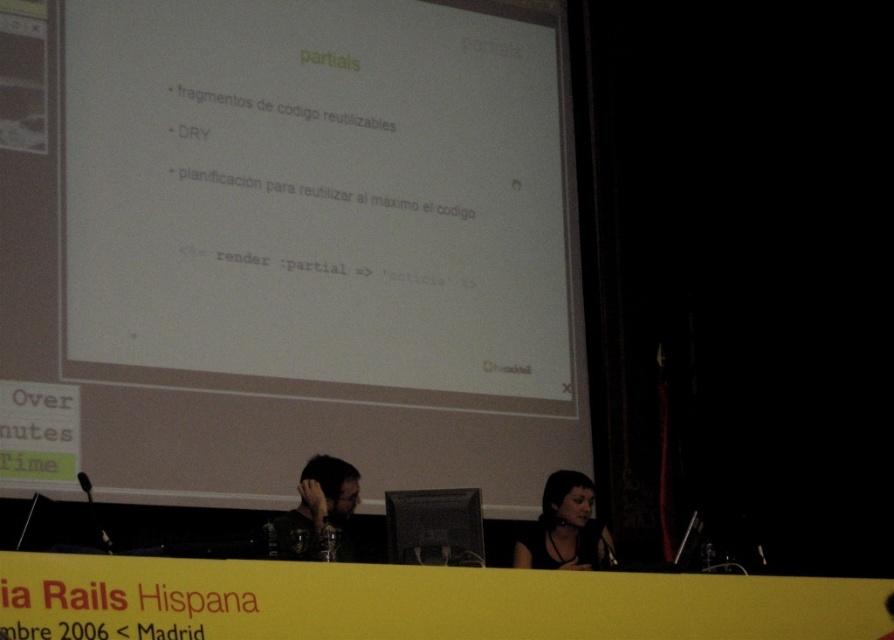
Does white matte projection screen at center appear on the right side of black leather hair at center?

Incorrect, white matte projection screen at center is not on the right side of black leather hair at center.

Can you confirm if white matte projection screen at center is taller than black leather hair at center?

Correct, white matte projection screen at center is much taller as black leather hair at center.

In order to click on white matte projection screen at center in this screenshot , I will do `click(285, 246)`.

This screenshot has height=640, width=894. What are the coordinates of `white matte projection screen at center` in the screenshot? It's located at (285, 246).

Who is positioned more to the left, black leather hair at center or matte black hair at center?

From the viewer's perspective, matte black hair at center appears more on the left side.

Identify the location of black leather hair at center. The width and height of the screenshot is (894, 640). (564, 529).

Does white matte projection screen at center have a lesser width compared to matte black hair at center?

No, white matte projection screen at center is not thinner than matte black hair at center.

Which of these two, white matte projection screen at center or matte black hair at center, stands taller?

white matte projection screen at center is taller.

This screenshot has height=640, width=894. Describe the element at coordinates (285, 246) in the screenshot. I see `white matte projection screen at center` at that location.

Image resolution: width=894 pixels, height=640 pixels. I want to click on white matte projection screen at center, so click(x=285, y=246).